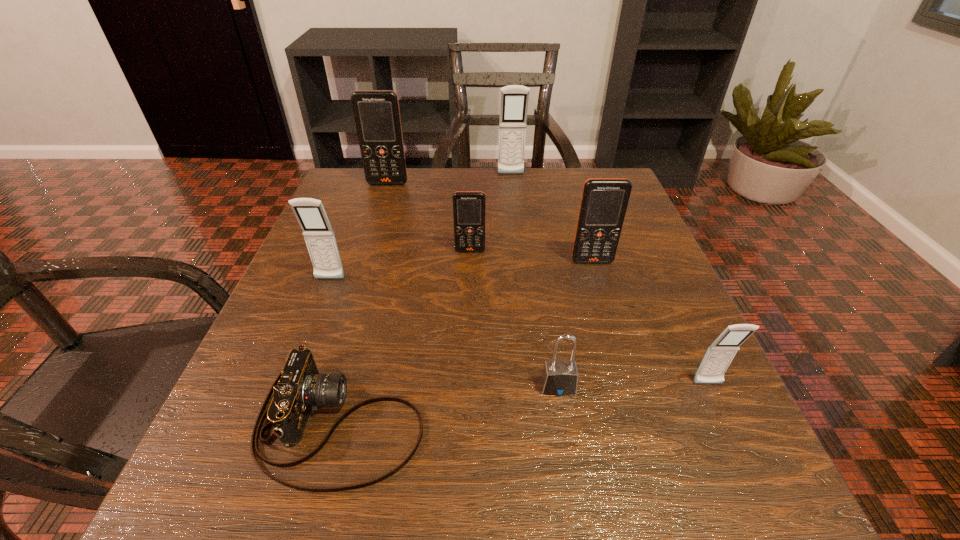
Identify the location of free space at the left edge of the desktop. (338, 286).

This screenshot has width=960, height=540. In the image, there is a desktop. Identify the location of blank space at the right edge. (625, 375).

Find the location of a particular element. The width and height of the screenshot is (960, 540). vacant space at the far left corner of the desktop is located at coordinates (393, 198).

Identify the location of free space at the near left corner of the desktop. This screenshot has width=960, height=540. (178, 505).

This screenshot has height=540, width=960. In the image, there is a desktop. Identify the location of free space at the far right corner. (573, 218).

The width and height of the screenshot is (960, 540). I want to click on blank space at the near right corner, so click(x=728, y=489).

Where is `free point between the fifth farthest cellular telephone and the second gray cellular telephone from right to left`? The image size is (960, 540). free point between the fifth farthest cellular telephone and the second gray cellular telephone from right to left is located at coordinates (420, 227).

I want to click on empty space that is in between the second farthest object and the camera, so click(x=364, y=303).

Locate an element on the screen. The height and width of the screenshot is (540, 960). vacant area between the leftmost gray cellular telephone and the seventh object from left to right is located at coordinates (461, 271).

I want to click on free space that is in between the third farthest cellular telephone and the fifth nearest cellular telephone, so click(429, 217).